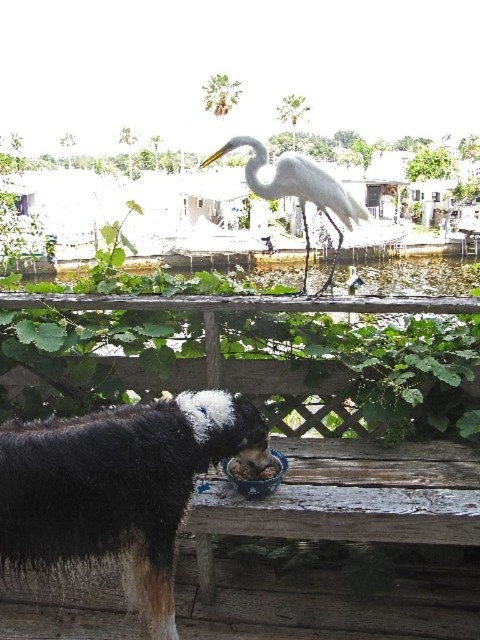
Question: Which point is closer to the camera taking this photo?

Choices:
 (A) (244, 476)
 (B) (332, 176)

Answer: (A)

Question: Can you confirm if black fur dog at center is thinner than brown matte bowl at lower center?

Choices:
 (A) yes
 (B) no

Answer: (B)

Question: Does black fur dog at center appear over brown matte bowl at lower center?

Choices:
 (A) yes
 (B) no

Answer: (B)

Question: Which of these objects is positioned closest to the black fur dog at center?

Choices:
 (A) brown matte bowl at lower center
 (B) white matte bird at center

Answer: (A)

Question: Among these objects, which one is farthest from the camera?

Choices:
 (A) white matte bird at center
 (B) brown matte bowl at lower center
 (C) black fur dog at center

Answer: (A)

Question: Is white matte bird at center below brown matte bowl at lower center?

Choices:
 (A) no
 (B) yes

Answer: (A)